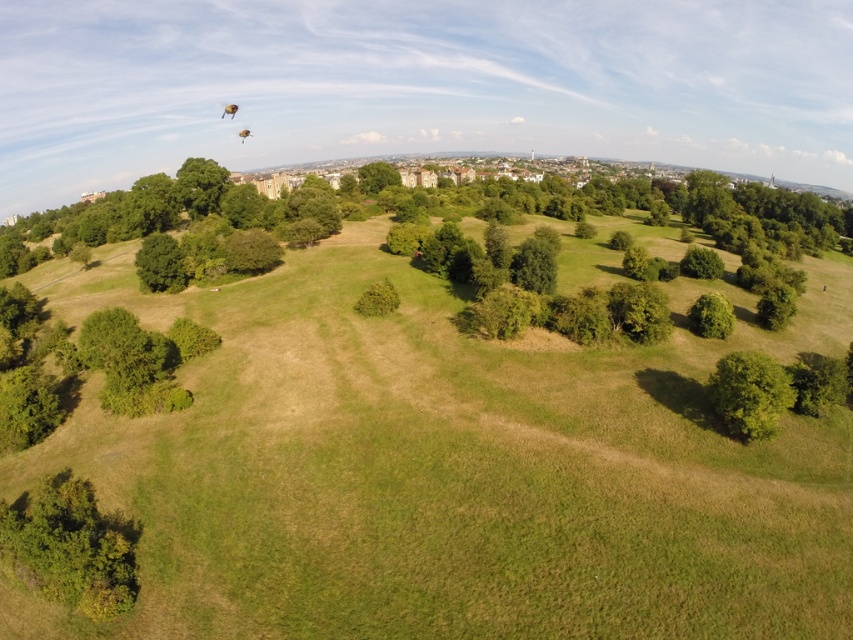
Question: Does green leafy bush at lower left have a larger size compared to green leafy tree at center-right?

Choices:
 (A) yes
 (B) no

Answer: (A)

Question: Based on their relative distances, which object is farther from the green leafy tree at lower right?

Choices:
 (A) green leafy tree at center-right
 (B) green leafy bush at lower left

Answer: (B)

Question: Which point is closer to the camera?

Choices:
 (A) (111, 554)
 (B) (720, 406)

Answer: (A)

Question: Among these points, which one is nearest to the camera?

Choices:
 (A) (132, 248)
 (B) (154, 276)

Answer: (B)

Question: In this image, where is green grassy field at center located relative to green leafy tree at lower right?

Choices:
 (A) above
 (B) below

Answer: (A)

Question: Does green leafy bush at lower left appear on the left side of green leafy tree at center-right?

Choices:
 (A) yes
 (B) no

Answer: (A)